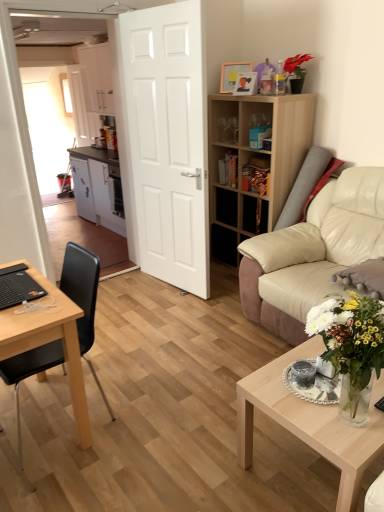
Image resolution: width=384 pixels, height=512 pixels. What do you see at coordinates (351, 347) in the screenshot? I see `white glossy vase at lower right` at bounding box center [351, 347].

You are a GUI agent. You are given a task and a screenshot of the screen. Output one action in this format:
    pyautogui.click(x=<x>, y=<y>)
    Task: Click on the white matte cabinet at center, which is the second cabinetry from bottom to top
    
    Given the screenshot: What is the action you would take?
    pyautogui.click(x=97, y=78)

Describe the element at coordinates (311, 422) in the screenshot. Image resolution: width=384 pixels, height=512 pixels. I see `light wood coffee table at lower right` at that location.

This screenshot has height=512, width=384. What do you see at coordinates (248, 159) in the screenshot?
I see `wooden bookshelf at right` at bounding box center [248, 159].

The width and height of the screenshot is (384, 512). What are the coordinates of `black plastic chair at left` in the screenshot? It's located at (83, 297).

You are a GUI agent. You are given a task and a screenshot of the screen. Output one action in this format:
    pyautogui.click(x=<x>, y=<y>)
    Task: Click on the beige leather couch at right
    The height and width of the screenshot is (512, 384).
    Given the screenshot: What is the action you would take?
    pyautogui.click(x=312, y=252)

You are a GUI agent. You are given a task and a screenshot of the screen. Output one action in this format:
    pyautogui.click(x=<x>, y=<y>)
    Task: Click on the white glossy vase at lower right
    
    Given the screenshot: What is the action you would take?
    pyautogui.click(x=351, y=347)

Does white matte cabinet at left, acting as the 1th cabinetry starting from the bottom, lie in front of wooden bookshelf at right?

That is False.

Does point (90, 186) appear closer or farther from the camera than point (248, 96)?

Point (90, 186) is positioned farther from the camera compared to point (248, 96).

Which cabinetry is the 2nd one when counting from the left side of the wooden bookshelf at right? Please provide its 2D coordinates.

[(98, 187)]

Between light wood coffee table at lower right and white glossy vase at lower right, which one has less height?

Standing shorter between the two is light wood coffee table at lower right.

Can you confirm if light wood coffee table at lower right is bigger than white glossy vase at lower right?

Indeed, light wood coffee table at lower right has a larger size compared to white glossy vase at lower right.

Is light wood coffee table at lower right facing towards white glossy vase at lower right?

No, light wood coffee table at lower right does not turn towards white glossy vase at lower right.

From the image's perspective, is wooden bookshelf at right above beige leather couch at right?

Yes, from the image's perspective, wooden bookshelf at right is on top of beige leather couch at right.

Can you tell me how much wooden bookshelf at right and beige leather couch at right differ in facing direction?

wooden bookshelf at right and beige leather couch at right are facing 0.345 degrees away from each other.

Considering the points (230, 117) and (359, 210), which point is behind, point (230, 117) or point (359, 210)?

The point (230, 117) is farther from the camera.

How much distance is there between wooden bookshelf at right and beige leather couch at right?

26.58 inches.

Is beige leather couch at right to the left of wooden picture frame at upper center, marked as the second picture frame in a front-to-back arrangement, from the viewer's perspective?

Incorrect, beige leather couch at right is not on the left side of wooden picture frame at upper center, marked as the second picture frame in a front-to-back arrangement.

Which is in front, point (265, 234) or point (227, 73)?

The point (265, 234) is closer.

Which object is thinner, beige leather couch at right or wooden picture frame at upper center, which is the first picture frame in back-to-front order?

wooden picture frame at upper center, which is the first picture frame in back-to-front order, is thinner.

Does beige leather couch at right have a larger size compared to wooden picture frame at upper center, which is the first picture frame in back-to-front order?

Correct, beige leather couch at right is larger in size than wooden picture frame at upper center, which is the first picture frame in back-to-front order.

Consider the image. From the image's perspective, is light wood coffee table at lower right below wooden bookshelf at right?

Yes.

Identify the location of shelf on the left of light wood coffee table at lower right. (248, 159).

Which of these two, light wood coffee table at lower right or wooden bookshelf at right, stands taller?

With more height is wooden bookshelf at right.

Looking at their sizes, would you say light wood coffee table at lower right is wider or thinner than wooden bookshelf at right?

Considering their sizes, light wood coffee table at lower right looks broader than wooden bookshelf at right.

Which object is closer to the camera taking this photo, white matte cabinet at center, the first cabinetry positioned from the top, or black plastic chair at left?

black plastic chair at left is more forward.

Consider the image. Who is smaller, white matte cabinet at center, the first cabinetry positioned from the top, or black plastic chair at left?

Smaller between the two is black plastic chair at left.

Are white matte cabinet at center, the first cabinetry positioned from the top, and black plastic chair at left far apart?

Yes.

What's the angular difference between white matte cabinet at center, the first cabinetry positioned from the top, and black plastic chair at left's facing directions?

3.56 degrees separate the facing orientations of white matte cabinet at center, the first cabinetry positioned from the top, and black plastic chair at left.

Are beige leather couch at right and light wood coffee table at lower right located far from each other?

No, beige leather couch at right is not far away from light wood coffee table at lower right.

Can we say beige leather couch at right lies outside light wood coffee table at lower right?

beige leather couch at right lies outside light wood coffee table at lower right's area.

Is beige leather couch at right turned away from light wood coffee table at lower right?

No.

Which of these two, beige leather couch at right or light wood coffee table at lower right, is bigger?

With larger size is beige leather couch at right.

From the image's perspective, which cabinetry is the 1st one above the wooden bookshelf at right? Please provide its 2D coordinates.

[(98, 187)]

The height and width of the screenshot is (512, 384). Identify the location of coffee table lying on the left of white glossy vase at lower right. (311, 422).

Estimate the real-world distances between objects in this image. Which object is further from wooden bookshelf at right, white matte cabinet at left, the 2th cabinetry in the top-to-bottom sequence, or wooden picture frame at upper center, which is the first picture frame in back-to-front order?

The object further to wooden bookshelf at right is white matte cabinet at left, the 2th cabinetry in the top-to-bottom sequence.

Looking at the image, which one is located further to beige leather couch at right, white matte cabinet at left, acting as the 1th cabinetry starting from the bottom, or white glossy vase at lower right?

The object further to beige leather couch at right is white matte cabinet at left, acting as the 1th cabinetry starting from the bottom.

Considering their positions, is black plastic chair at left positioned closer to wooden bookshelf at right than white matte cabinet at center, the first cabinetry positioned from the top?

black plastic chair at left.

Which object lies nearer to the anchor point beige leather couch at right, white matte door at center or light wood coffee table at lower right?

Based on the image, light wood coffee table at lower right appears to be nearer to beige leather couch at right.

Looking at the image, which one is located closer to wooden picture frame at upper center, marked as the second picture frame in a front-to-back arrangement, white matte cabinet at left, the 2th cabinetry in the top-to-bottom sequence, or beige leather couch at right?

The object closer to wooden picture frame at upper center, marked as the second picture frame in a front-to-back arrangement, is beige leather couch at right.

Which object lies further to the anchor point wooden bookshelf at right, white matte cabinet at center, the first cabinetry positioned from the top, or black plastic chair at left?

white matte cabinet at center, the first cabinetry positioned from the top, is positioned further to the anchor wooden bookshelf at right.

Which object lies nearer to the anchor point light wood coffee table at lower right, white matte door at center or white glossy vase at lower right?

white glossy vase at lower right lies closer to light wood coffee table at lower right than the other object.

When comparing their distances from black plastic chair at left, does light wood coffee table at lower right or wooden picture frame at upper center, which is the first picture frame in back-to-front order, seem closer?

Among the two, light wood coffee table at lower right is located nearer to black plastic chair at left.

Identify the location of shelf between beige leather couch at right and white matte cabinet at center, the first cabinetry positioned from the top, from front to back. Image resolution: width=384 pixels, height=512 pixels. click(248, 159).

Locate an element on the screen. cabinetry positioned between wooden bookshelf at right and white matte cabinet at left, acting as the 1th cabinetry starting from the bottom, from near to far is located at coordinates (97, 78).

Identify the location of coffee table positioned between white glossy vase at lower right and white matte cabinet at center, the first cabinetry positioned from the top, from near to far. (311, 422).

Image resolution: width=384 pixels, height=512 pixels. I want to click on studio couch between white glossy vase at lower right and white matte cabinet at left, acting as the 1th cabinetry starting from the bottom, from front to back, so click(x=312, y=252).